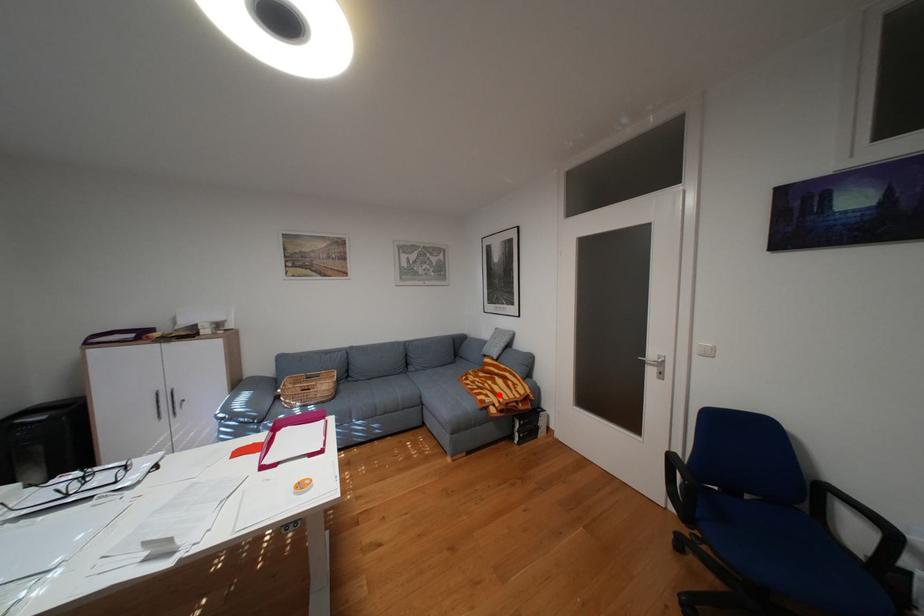
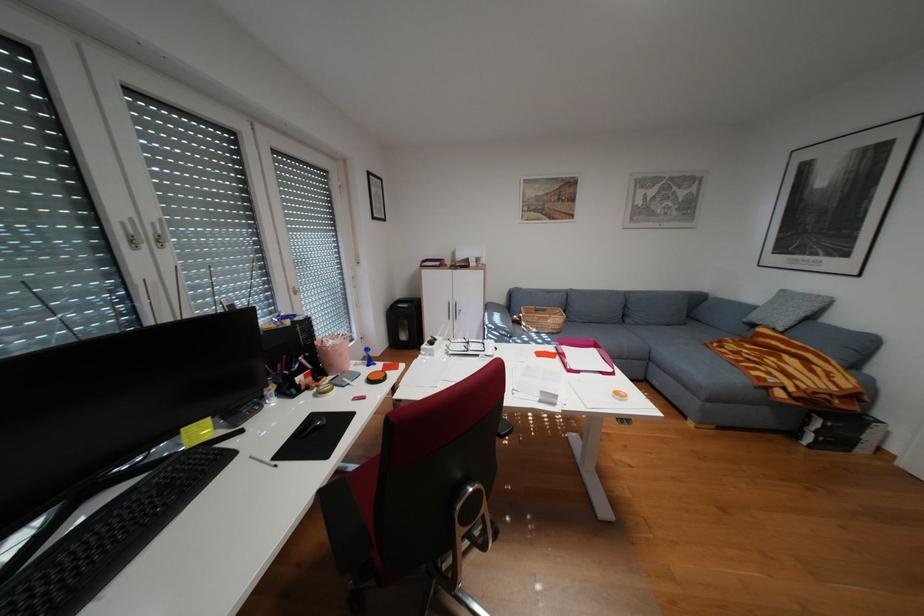
Question: I am providing you with two images of the same scene from different viewpoints. Given a red point in image1, look at the same physical point in image2. Is it:

Choices:
 (A) Closer to the viewpoint
 (B) Farther from the viewpoint

Answer: (A)